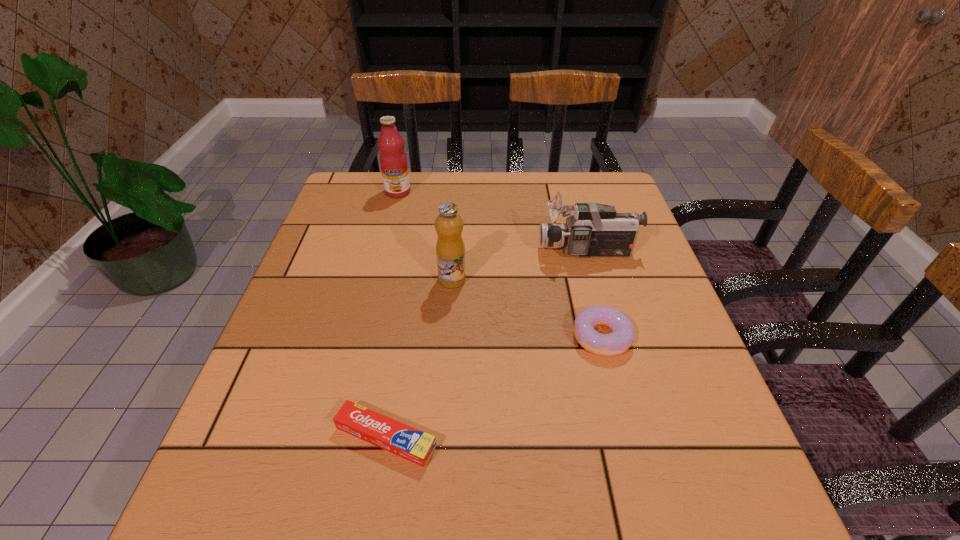
Locate an element on the screen. doughnut that is at the right edge is located at coordinates (622, 336).

Where is `object located at the far left corner`? This screenshot has height=540, width=960. object located at the far left corner is located at coordinates (393, 161).

In order to click on free space at the far edge of the desktop in this screenshot , I will do `click(430, 180)`.

At what (x,y) coordinates should I click in order to perform the action: click on vacant space at the near edge of the desktop. Please return your answer as a coordinate pair (x, y). Looking at the image, I should click on click(x=365, y=487).

The height and width of the screenshot is (540, 960). In the image, there is a desktop. Find the location of `vacant region at the left edge`. vacant region at the left edge is located at coordinates (292, 326).

Locate an element on the screen. Image resolution: width=960 pixels, height=540 pixels. vacant space at the right edge of the desktop is located at coordinates (642, 315).

Where is `free location at the far left corner of the desktop`? Image resolution: width=960 pixels, height=540 pixels. free location at the far left corner of the desktop is located at coordinates (333, 213).

This screenshot has width=960, height=540. In the image, there is a desktop. What are the coordinates of `free space at the near right corner` in the screenshot? It's located at (686, 526).

You are a GUI agent. You are given a task and a screenshot of the screen. Output one action in this format:
    pyautogui.click(x=<x>, y=<y>)
    Task: Click on the free space between the farther fruit juice and the shortest object
    
    Given the screenshot: What is the action you would take?
    pyautogui.click(x=392, y=314)

Locate an element on the screen. vacant area between the second shortest object and the third nearest object is located at coordinates (527, 308).